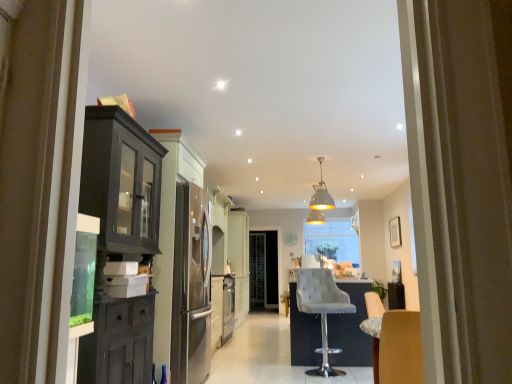
Question: Is gray fabric bar stool at center to the left of white matte pendant light at center from the viewer's perspective?

Choices:
 (A) no
 (B) yes

Answer: (B)

Question: Considering the relative sizes of gray fabric bar stool at center and white matte pendant light at center in the image provided, is gray fabric bar stool at center taller than white matte pendant light at center?

Choices:
 (A) yes
 (B) no

Answer: (A)

Question: Considering the relative sizes of gray fabric bar stool at center and white matte pendant light at center in the image provided, is gray fabric bar stool at center bigger than white matte pendant light at center?

Choices:
 (A) yes
 (B) no

Answer: (A)

Question: Is gray fabric bar stool at center further to the viewer compared to white matte pendant light at center?

Choices:
 (A) no
 (B) yes

Answer: (A)

Question: Is the depth of gray fabric bar stool at center less than that of white matte pendant light at center?

Choices:
 (A) yes
 (B) no

Answer: (A)

Question: From a real-world perspective, is gray fabric bar stool at center located beneath white matte pendant light at center?

Choices:
 (A) no
 (B) yes

Answer: (B)

Question: Is white matte pendant light at center not near gray fabric bar stool at center?

Choices:
 (A) yes
 (B) no

Answer: (A)

Question: Is white matte pendant light at center behind gray fabric bar stool at center?

Choices:
 (A) yes
 (B) no

Answer: (A)

Question: Are white matte pendant light at center and gray fabric bar stool at center making contact?

Choices:
 (A) no
 (B) yes

Answer: (A)

Question: Does white matte pendant light at center have a larger size compared to gray fabric bar stool at center?

Choices:
 (A) no
 (B) yes

Answer: (A)

Question: From the image's perspective, is white matte pendant light at center below gray fabric bar stool at center?

Choices:
 (A) no
 (B) yes

Answer: (A)

Question: Is white matte pendant light at center at the left side of gray fabric bar stool at center?

Choices:
 (A) yes
 (B) no

Answer: (B)

Question: In terms of width, does white matte pendant light at center look wider or thinner when compared to gray fabric bar stool at center?

Choices:
 (A) thin
 (B) wide

Answer: (A)